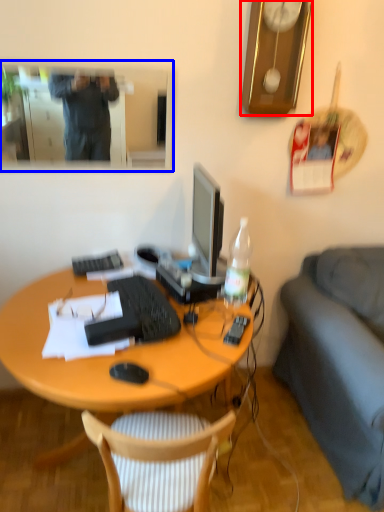
Question: Among these objects, which one is farthest to the camera, clock (highlighted by a red box) or mirror (highlighted by a blue box)?

Choices:
 (A) clock
 (B) mirror

Answer: (B)